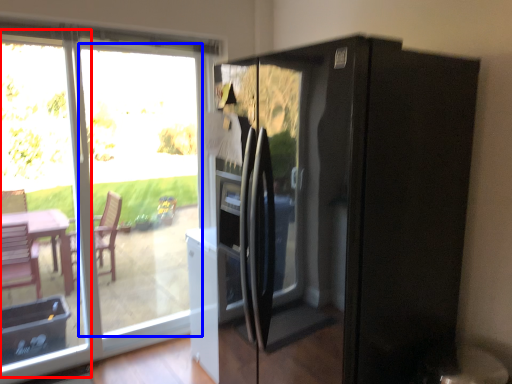
Question: Which object is further to the camera taking this photo, glass door (highlighted by a red box) or glass door (highlighted by a blue box)?

Choices:
 (A) glass door
 (B) glass door

Answer: (B)